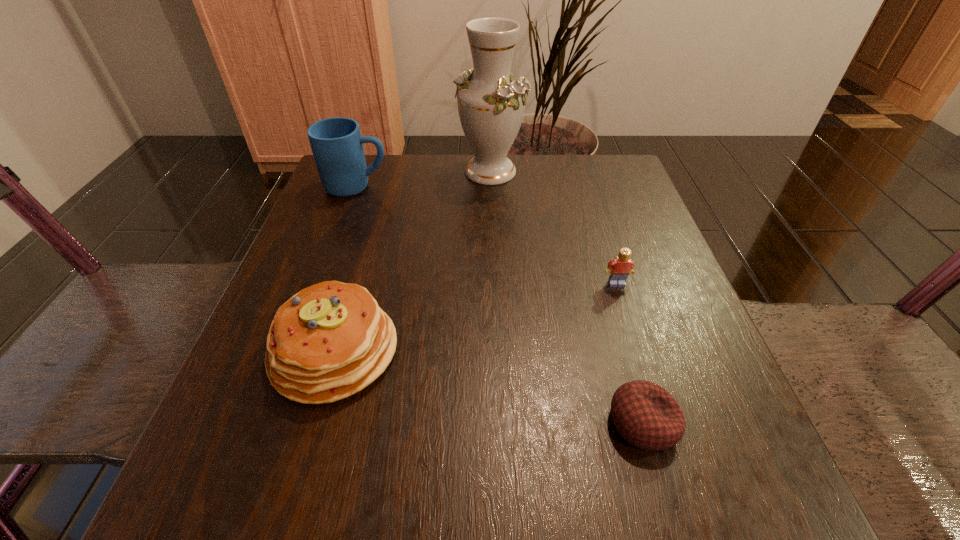
This screenshot has height=540, width=960. I want to click on object present at the near right corner, so click(645, 414).

Find the location of `blank space at the far edge of the desktop`. blank space at the far edge of the desktop is located at coordinates (494, 203).

In order to click on blank space at the near edge of the desktop in this screenshot , I will do `click(324, 463)`.

The width and height of the screenshot is (960, 540). In order to click on free space at the right edge in this screenshot , I will do coord(721,443).

The width and height of the screenshot is (960, 540). In order to click on vacant position at the far left corner of the desktop in this screenshot , I will do `click(372, 206)`.

In the image, there is a desktop. What are the coordinates of `vacant space at the near left corner` in the screenshot? It's located at (213, 460).

Identify the location of free space at the far right corner of the desktop. The width and height of the screenshot is (960, 540). (585, 171).

Identify the location of free location at the near right corner. (683, 516).

Locate an element on the screen. free space between the beanbag and the second tallest object is located at coordinates (500, 305).

Where is `free space between the third farthest object and the vase`? Image resolution: width=960 pixels, height=540 pixels. free space between the third farthest object and the vase is located at coordinates (553, 227).